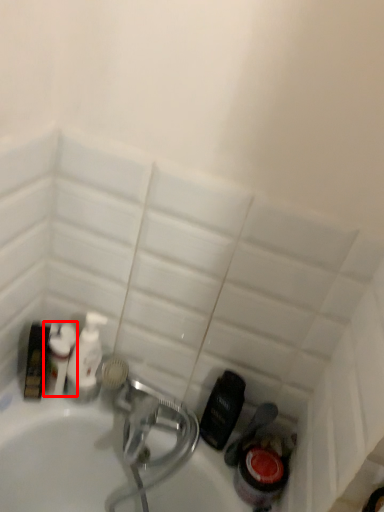
Question: From the image's perspective, what is the correct spatial relationship of cleaning product (annotated by the red box) in relation to cleaning product?

Choices:
 (A) below
 (B) above

Answer: (B)